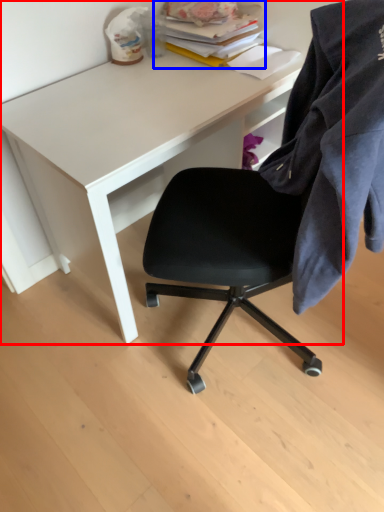
Question: Which object appears farthest to the camera in this image, desk (highlighted by a red box) or book (highlighted by a blue box)?

Choices:
 (A) desk
 (B) book

Answer: (B)